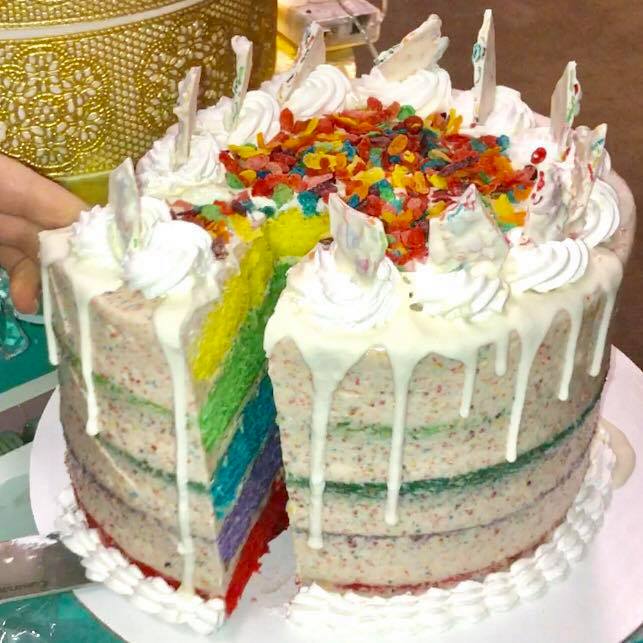
You are a GUI agent. You are given a task and a screenshot of the screen. Output one action in this format:
    pyautogui.click(x=<x>, y=<y>)
    Task: Click on the platter
    The image size is (643, 643).
    Given the screenshot: What is the action you would take?
    pyautogui.click(x=617, y=564)